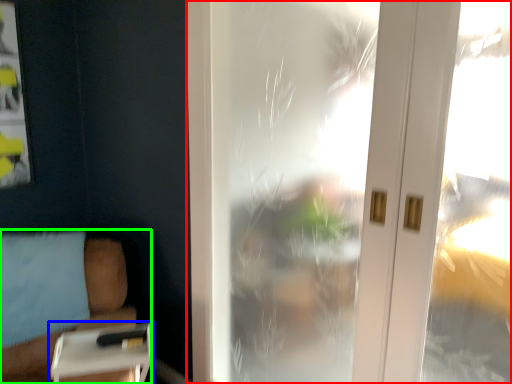
Question: Which object is the farthest from window (highlighted by a red box)? Choose among these: table (highlighted by a blue box) or furniture (highlighted by a green box).

Choices:
 (A) table
 (B) furniture

Answer: (A)